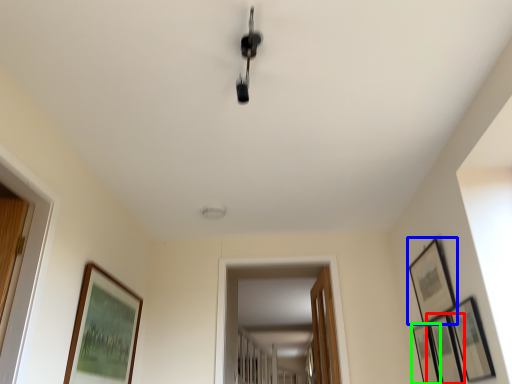
Question: Which is farther away from picture frame (highlighted by a red box)? picture frame (highlighted by a blue box) or picture frame (highlighted by a green box)?

Choices:
 (A) picture frame
 (B) picture frame

Answer: (A)